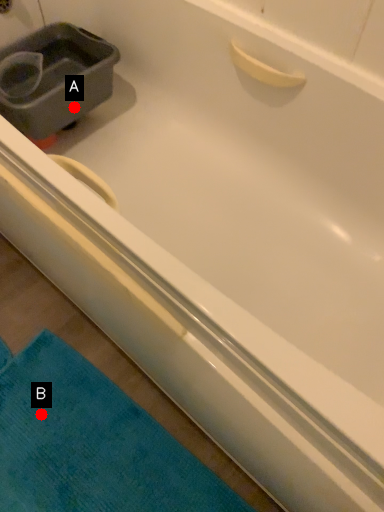
Question: Two points are circled on the image, labeled by A and B beside each circle. Which point is closer to the camera?

Choices:
 (A) A is closer
 (B) B is closer

Answer: (B)